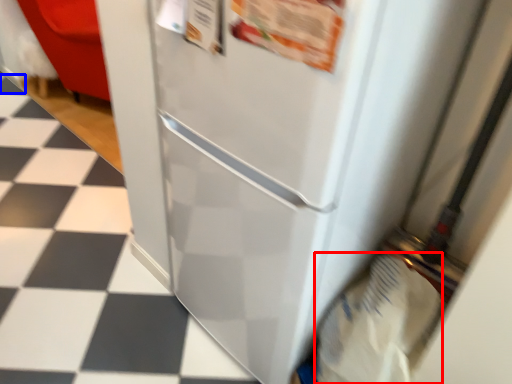
Question: Which point is closer to the camera, grocery bag (highlighted by a red box) or tile (highlighted by a blue box)?

Choices:
 (A) grocery bag
 (B) tile

Answer: (A)